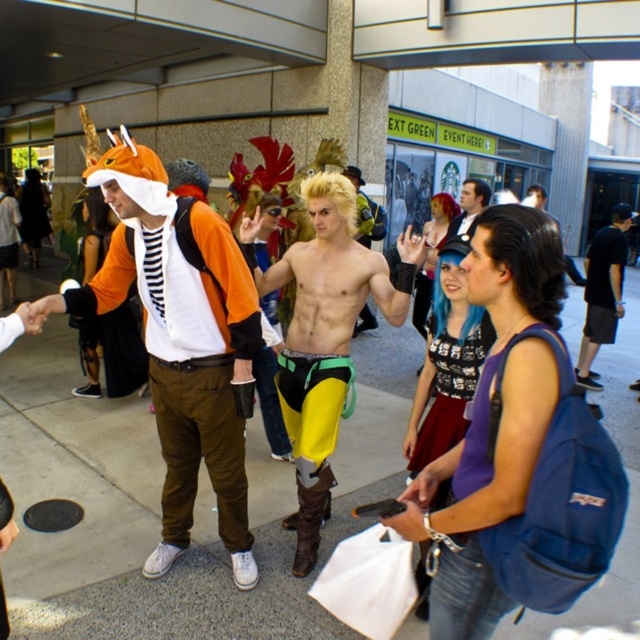
You are a photographer at the event and want to capture a photo of both the orange fabric fox costume at left and the smooth black hair at center. Based on their positions, which object should you focus on first to ensure both are in frame?

The orange fabric fox costume at left is below smooth black hair at center, so you should focus on the smooth black hair at center first to ensure both are in frame.

You are a photographer at the event, and you need to capture a photo of the shiny yellow pants at center and smooth black hair at center. Since you want to highlight the width difference between them, which object should you focus on to emphasize their width?

The shiny yellow pants at center should be focused on to emphasize their width since they are wider than the smooth black hair at center.